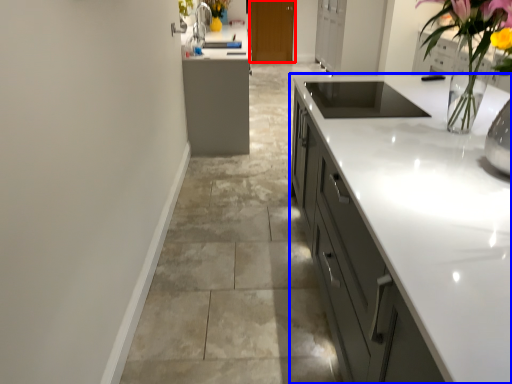
Question: Which point is further to the camera, cabinetry (highlighted by a red box) or cabinetry (highlighted by a blue box)?

Choices:
 (A) cabinetry
 (B) cabinetry

Answer: (A)